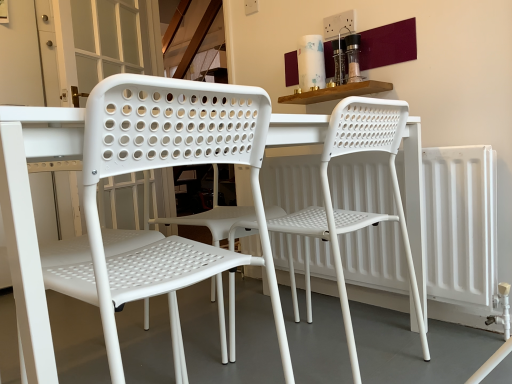
Find the location of a particular element. The image size is (512, 384). vacant space that is to the left of white plastic chair at center, placed as the 2th chair when sorted from left to right is located at coordinates (202, 351).